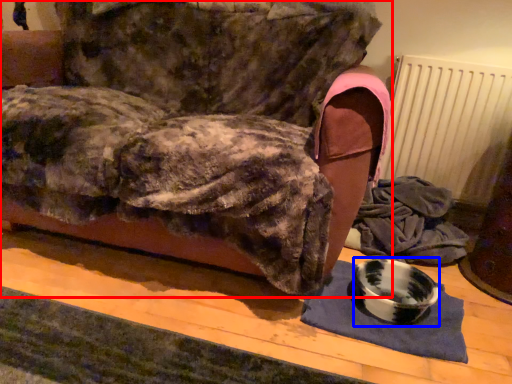
Question: Which point is closer to the camera, furniture (highlighted by a red box) or bowl (highlighted by a blue box)?

Choices:
 (A) furniture
 (B) bowl

Answer: (A)